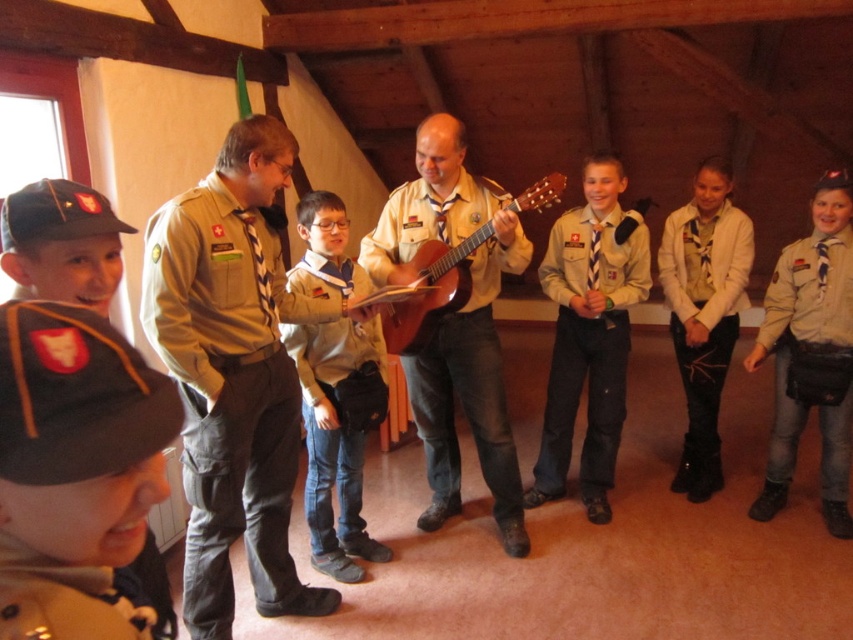
Question: Which is nearer to the brown fabric sash at right?

Choices:
 (A) khaki uniform at center
 (B) khaki uniform cap at lower left

Answer: (A)

Question: Does matte brown guitar at center appear over white matte jacket at center?

Choices:
 (A) no
 (B) yes

Answer: (B)

Question: Considering the relative positions of matte brown guitar at center and khaki fabric cap at lower left in the image provided, where is matte brown guitar at center located with respect to khaki fabric cap at lower left?

Choices:
 (A) left
 (B) right

Answer: (B)

Question: Which of the following is the closest to the observer?

Choices:
 (A) brown fabric sash at right
 (B) light brown fabric shirt at center

Answer: (A)

Question: Which of the following is the closest to the observer?

Choices:
 (A) (350, 476)
 (B) (526, 264)

Answer: (B)

Question: In this image, where is khaki uniform cap at lower left located relative to white matte jacket at center?

Choices:
 (A) left
 (B) right

Answer: (A)